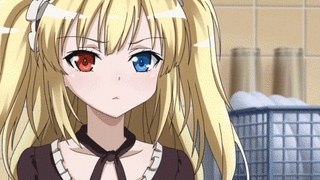
What are the coordinates of `bluish gray dish rack` in the screenshot? It's located at (289, 108), (257, 109), (270, 146), (268, 172).